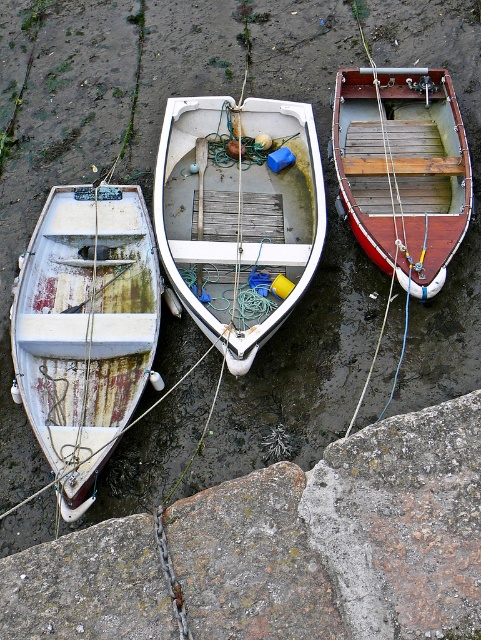
What is located at the point with coordinates (85, 328) in the image?

The point at coordinates (85, 328) indicates the rusty metal boat at left.

You are a dock worker who needs to move the white matte wooden boat at center. There is a rusty concrete stone at lower left in the way. Can you lift the stone to move the boat?

The rusty concrete stone at lower left has a smaller size compared to white matte wooden boat at center, so it might be possible to lift the stone and move the boat.

You are standing on the dock and want to access the wooden boat at center. Is the rusty metal boat at left blocking your path?

The rusty metal boat at left is positioned under the wooden boat at center, so it is blocking the path to the wooden boat at center.